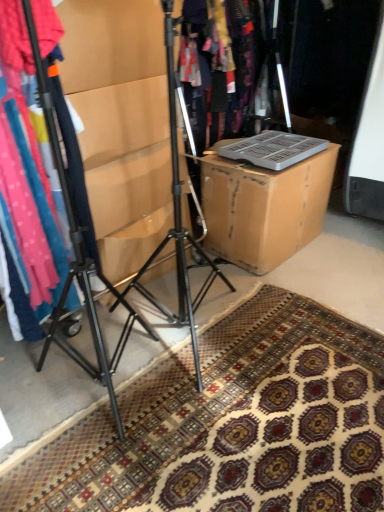
Question: Considering the relative sizes of brown cardboard box at center and black metal tripod at center in the image provided, is brown cardboard box at center smaller than black metal tripod at center?

Choices:
 (A) no
 (B) yes

Answer: (A)

Question: Can you confirm if brown cardboard box at center is thinner than black metal tripod at center?

Choices:
 (A) yes
 (B) no

Answer: (B)

Question: From the image's perspective, does brown cardboard box at center appear higher than black metal tripod at center?

Choices:
 (A) yes
 (B) no

Answer: (A)

Question: Is brown cardboard box at center positioned before black metal tripod at center?

Choices:
 (A) yes
 (B) no

Answer: (B)

Question: Does brown cardboard box at center turn towards black metal tripod at center?

Choices:
 (A) no
 (B) yes

Answer: (A)

Question: Looking at the image, does black metal tripod at center seem bigger or smaller compared to brown cardboard box at center?

Choices:
 (A) small
 (B) big

Answer: (A)

Question: Would you say black metal tripod at center is inside or outside brown cardboard box at center?

Choices:
 (A) inside
 (B) outside

Answer: (B)

Question: Is black metal tripod at center to the left or to the right of brown cardboard box at center in the image?

Choices:
 (A) left
 (B) right

Answer: (A)

Question: Relative to brown cardboard box at center, is black metal tripod at center in front or behind?

Choices:
 (A) behind
 (B) front

Answer: (B)

Question: Is patterned carpet at lower center in front of or behind matte plastic laptop at center in the image?

Choices:
 (A) behind
 (B) front

Answer: (B)

Question: Which is correct: patterned carpet at lower center is inside matte plastic laptop at center, or outside of it?

Choices:
 (A) inside
 (B) outside

Answer: (B)

Question: Considering the positions of point (x=254, y=415) and point (x=238, y=7), is point (x=254, y=415) closer or farther from the camera than point (x=238, y=7)?

Choices:
 (A) farther
 (B) closer

Answer: (B)

Question: Is patterned carpet at lower center wider or thinner than matte plastic laptop at center?

Choices:
 (A) wide
 (B) thin

Answer: (A)

Question: Considering the positions of patterned carpet at lower center and brown cardboard box at center in the image, is patterned carpet at lower center bigger or smaller than brown cardboard box at center?

Choices:
 (A) small
 (B) big

Answer: (A)

Question: In terms of height, does patterned carpet at lower center look taller or shorter compared to brown cardboard box at center?

Choices:
 (A) tall
 (B) short

Answer: (B)